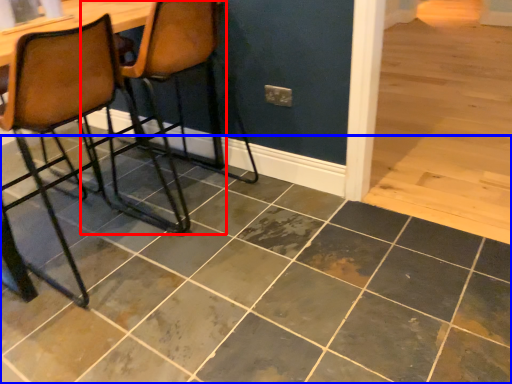
Question: Among these objects, which one is farthest to the camera, chair (highlighted by a red box) or ceramic tile (highlighted by a blue box)?

Choices:
 (A) chair
 (B) ceramic tile

Answer: (A)